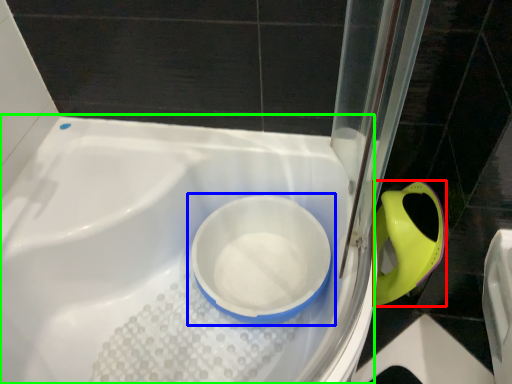
Question: Which object is the closest to the bidet (highlighted by a red box)? Choose among these: toilet (highlighted by a blue box) or bath (highlighted by a green box).

Choices:
 (A) toilet
 (B) bath

Answer: (A)